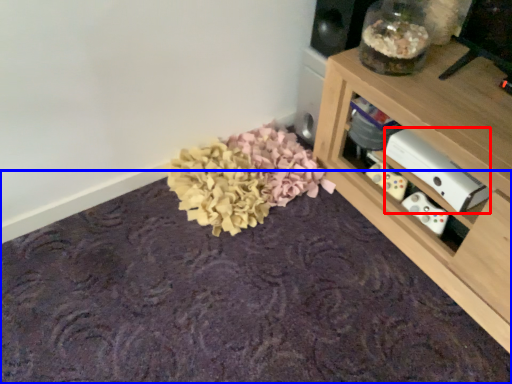
Question: Which object appears farthest to the camera in this image, appliance (highlighted by a red box) or mat (highlighted by a blue box)?

Choices:
 (A) appliance
 (B) mat

Answer: (A)